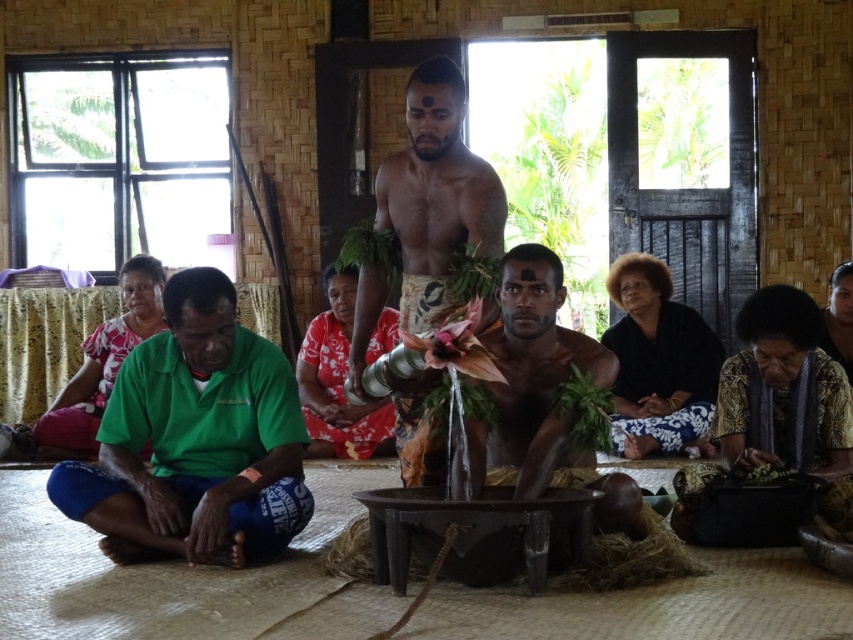
Question: Which point is farther to the camera?

Choices:
 (A) natural wood staff at center
 (B) black fabric at center
 (C) brown woven cloth at center
 (D) smooth wooden bowl at center

Answer: (B)

Question: Does printed fabric basket at lower right have a greater width compared to brown woven cloth at center?

Choices:
 (A) no
 (B) yes

Answer: (B)

Question: Which point is farther from the camera taking this photo?

Choices:
 (A) (389, 333)
 (B) (289, 445)
 (C) (428, 292)
 (D) (477, 490)

Answer: (A)

Question: Does green fabric shirt at lower left appear on the right side of printed fabric basket at lower right?

Choices:
 (A) no
 (B) yes

Answer: (A)

Question: Based on their relative distances, which object is farther from the green fabric shirt at lower left?

Choices:
 (A) matte green shirt at lower left
 (B) brown woven cloth at center
 (C) black fabric at center

Answer: (C)

Question: Is black fabric at center positioned in front of smooth wooden bowl at center?

Choices:
 (A) yes
 (B) no

Answer: (B)